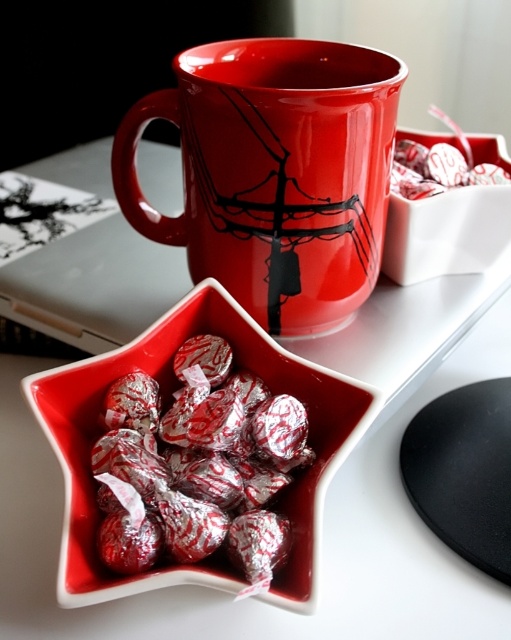
Is point (195, 269) farther from camera compared to point (412, 196)?

No.

You are a GUI agent. You are given a task and a screenshot of the screen. Output one action in this format:
    pyautogui.click(x=<x>, y=<y>)
    Task: Click on the glossy ceramic mug at upper center
    This screenshot has width=511, height=640.
    Given the screenshot: What is the action you would take?
    pyautogui.click(x=274, y=173)

Between silver foil wrapped heart at center and silver foil heart at center, which one appears on the left side from the viewer's perspective?

silver foil wrapped heart at center is more to the left.

Can you confirm if silver foil wrapped heart at center is smaller than silver foil heart at center?

No, silver foil wrapped heart at center is not smaller than silver foil heart at center.

Is point (155, 532) farther from camera compared to point (399, 141)?

No, it is in front of (399, 141).

Locate an element on the screen. This screenshot has height=640, width=511. silver foil wrapped heart at center is located at coordinates (197, 465).

Between glossy ceramic mug at upper center and silver foil wrapped heart at center, which one is positioned higher?

Positioned higher is glossy ceramic mug at upper center.

Is glossy ceramic mug at upper center thinner than silver foil wrapped heart at center?

Incorrect, glossy ceramic mug at upper center's width is not less than silver foil wrapped heart at center's.

What do you see at coordinates (274, 173) in the screenshot?
I see `glossy ceramic mug at upper center` at bounding box center [274, 173].

Find the location of a particular element. glossy ceramic mug at upper center is located at coordinates (274, 173).